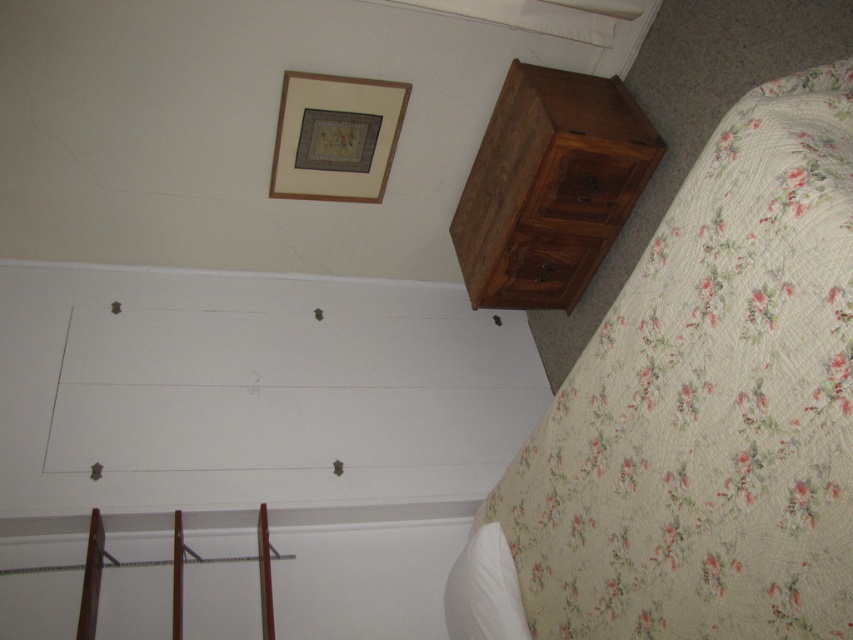
Based on the photo, you are arranging a new lamp on the bed. To ensure it doesn not fall off, you need to know where the bed is relative to the picture frame. Is the floral quilted bed at lower right located below or above the matte wood picture frame at upper center?

The floral quilted bed at lower right is positioned under the matte wood picture frame at upper center, so it is located below the frame.

You are trying to place a decorative item on the surface between the dark brown wood drawer at upper right and the white soft pillow at lower right. Which object should you move to make space?

The dark brown wood drawer at upper right is wider than the white soft pillow at lower right, so you should move the white soft pillow at lower right to make space.

You are a delivery person who needs to place a small package between the dark brown wood drawer at upper right and the white soft pillow at lower right. Is there enough space to fit the package, which is 1 meter long?

The distance between the dark brown wood drawer at upper right and the white soft pillow at lower right is 90.86 centimeters. Since the package is 1 meter long, which is longer than the available space, it won